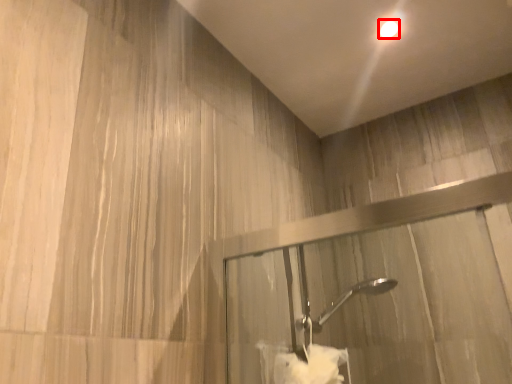
Question: Observing the image, what is the correct spatial positioning of droplight (annotated by the red box) in reference to bath towel?

Choices:
 (A) left
 (B) right

Answer: (B)